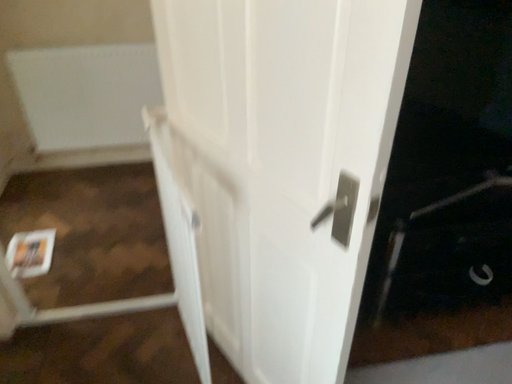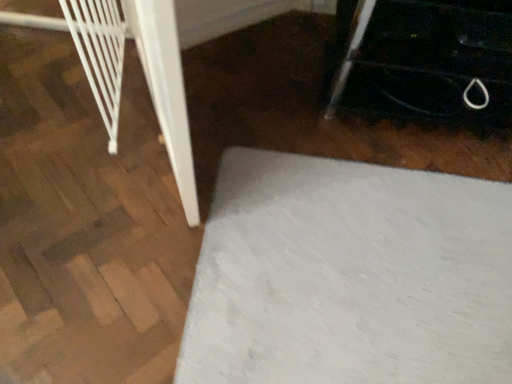
Question: How did the camera likely rotate when shooting the video?

Choices:
 (A) rotated right
 (B) rotated left

Answer: (B)